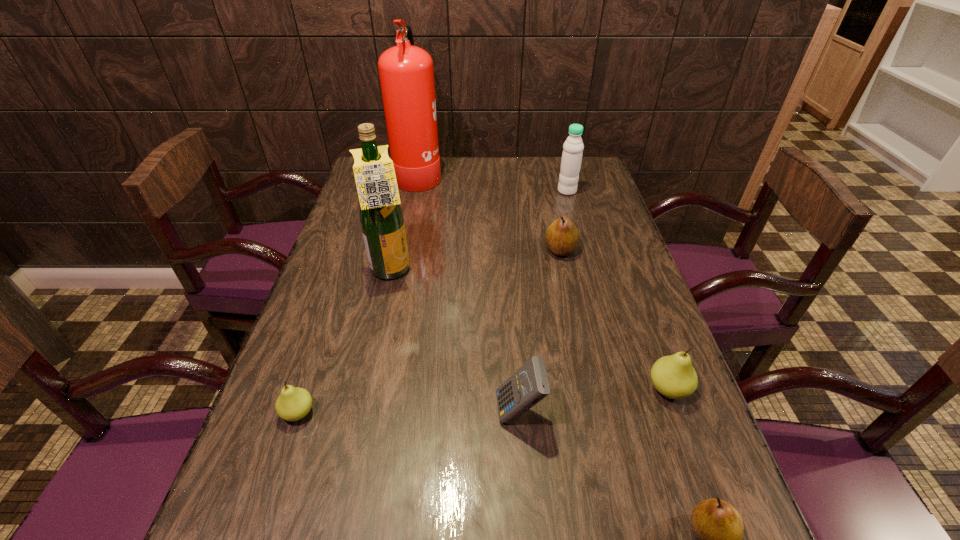
Where is `vacant space situated 0.080m on the front of the leftmost object`? The width and height of the screenshot is (960, 540). vacant space situated 0.080m on the front of the leftmost object is located at coordinates (279, 469).

You are a GUI agent. You are given a task and a screenshot of the screen. Output one action in this format:
    pyautogui.click(x=<x>, y=<y>)
    Task: Click on the fire extinguisher that is positioned at the far edge
    
    Given the screenshot: What is the action you would take?
    pyautogui.click(x=406, y=73)

You are a GUI agent. You are given a task and a screenshot of the screen. Output one action in this format:
    pyautogui.click(x=<x>, y=<y>)
    Task: Click on the water bottle that is at the far edge
    
    Given the screenshot: What is the action you would take?
    pyautogui.click(x=573, y=147)

I want to click on fire extinguisher at the left edge, so click(406, 73).

The height and width of the screenshot is (540, 960). Find the location of `liquor positioned at the left edge`. liquor positioned at the left edge is located at coordinates (381, 216).

This screenshot has width=960, height=540. I want to click on pear situated at the left edge, so click(293, 403).

Find the location of `water bottle that is at the right edge`. water bottle that is at the right edge is located at coordinates (573, 147).

Find the location of `object present at the far left corner`. object present at the far left corner is located at coordinates (406, 73).

This screenshot has height=540, width=960. In order to click on object that is positioned at the far right corner in this screenshot , I will do `click(573, 147)`.

At what (x,y) coordinates should I click in order to perform the action: click on vacant region at the far edge of the desktop. Please return your answer as a coordinate pair (x, y). Looking at the image, I should click on (445, 163).